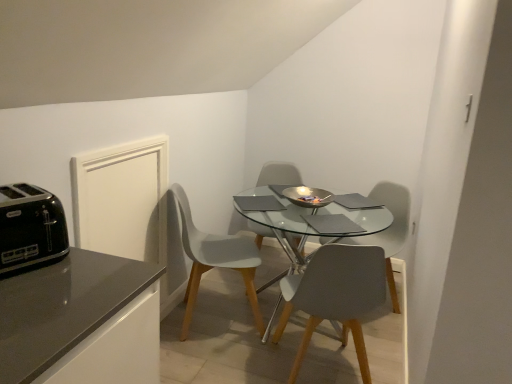
Question: Looking at the image, does transparent glass table at center seem bigger or smaller compared to black plastic toaster at left?

Choices:
 (A) small
 (B) big

Answer: (B)

Question: From a real-world perspective, is transparent glass table at center physically located above or below black plastic toaster at left?

Choices:
 (A) above
 (B) below

Answer: (B)

Question: Which of these objects is positioned farthest from the matte gray chair at center, marked as the third chair in a right-to-left arrangement?

Choices:
 (A) black plastic toaster at left
 (B) matte gray chair at center, which is counted as the 4th chair, starting from the left
 (C) transparent glass table at center
 (D) white matte chair at center, the first chair from the left
 (E) matte gray chair at center, the 2th chair when ordered from right to left

Answer: (A)

Question: Considering the real-world distances, which object is closest to the black plastic toaster at left?

Choices:
 (A) matte gray chair at center, marked as the third chair in a right-to-left arrangement
 (B) transparent glass table at center
 (C) white matte chair at center, positioned as the fourth chair in right-to-left order
 (D) matte gray chair at center, which is counted as the 4th chair, starting from the left
 (E) matte gray chair at center, the 2th chair when ordered from right to left

Answer: (E)